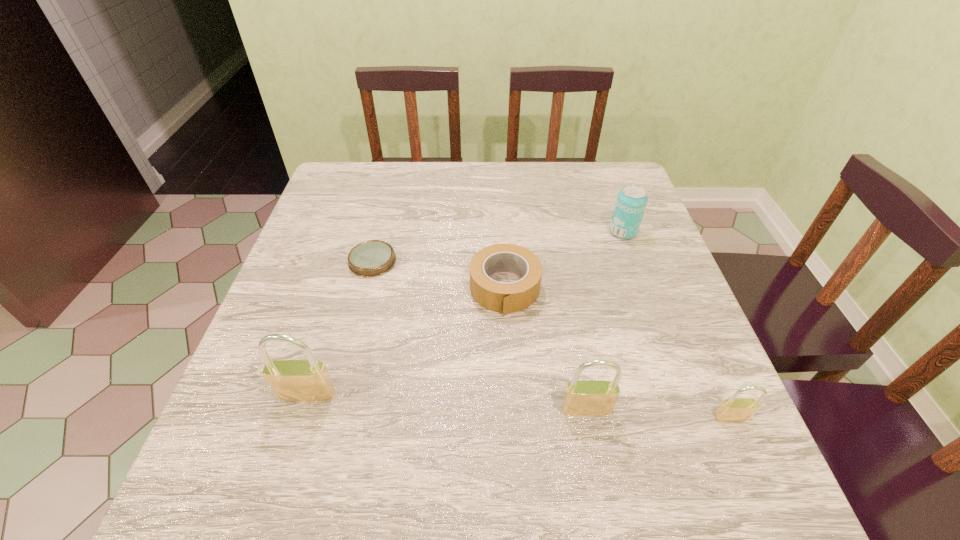
At what (x,y) coordinates should I click in order to perform the action: click on the farthest padlock. Please return your answer as a coordinate pair (x, y). Looking at the image, I should click on (308, 380).

Image resolution: width=960 pixels, height=540 pixels. Identify the location of the leftmost padlock. point(308,380).

This screenshot has width=960, height=540. What are the coordinates of `the second shortest padlock` in the screenshot? It's located at (587, 397).

Locate an element on the screen. the second padlock from right to left is located at coordinates (587, 397).

The width and height of the screenshot is (960, 540). What are the coordinates of `the fourth tallest object` in the screenshot? It's located at (734, 409).

This screenshot has width=960, height=540. Find the location of `the rightmost object`. the rightmost object is located at coordinates pyautogui.click(x=734, y=409).

Locate an element on the screen. The width and height of the screenshot is (960, 540). compass is located at coordinates (371, 258).

Where is `the farthest object`? the farthest object is located at coordinates (630, 205).

I want to click on beer can, so click(630, 205).

Where is `the second shortest object`? The image size is (960, 540). the second shortest object is located at coordinates (505, 298).